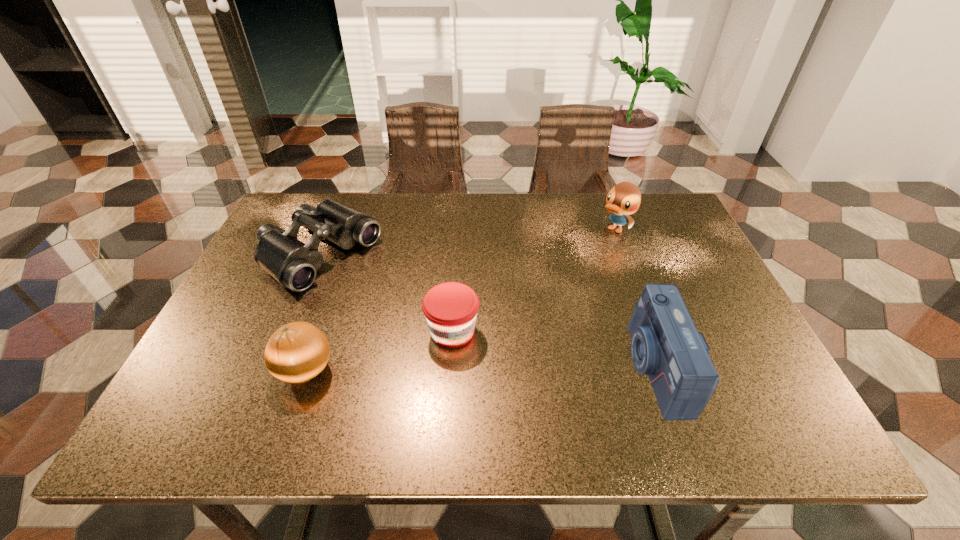
Find the location of `empty space that is in between the duck and the shortest object`. empty space that is in between the duck and the shortest object is located at coordinates (534, 280).

Identify the location of vacant space that is in between the duck and the camera. (635, 299).

Find the location of `object that is the closest to the shortest object`. object that is the closest to the shortest object is located at coordinates (292, 263).

Where is `object that stands as the second closest to the duck`? object that stands as the second closest to the duck is located at coordinates (450, 308).

Where is `vacant point that satisfies the following two spatial constraints: 1. on the front side of the jam; 2. on the lens of the camera`? This screenshot has width=960, height=540. vacant point that satisfies the following two spatial constraints: 1. on the front side of the jam; 2. on the lens of the camera is located at coordinates (450, 367).